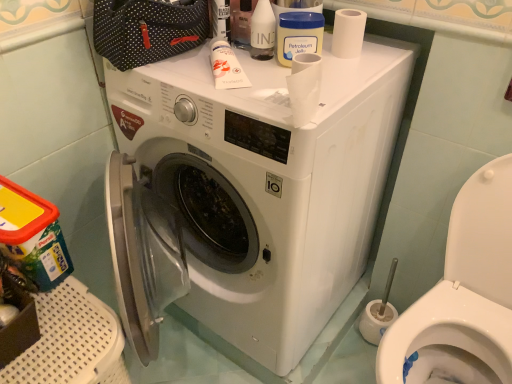
Where is `vacant space situated on the left part of translucent plastic bottle at upper center, the 2th toiletry in the bottom-to-top sequence`? vacant space situated on the left part of translucent plastic bottle at upper center, the 2th toiletry in the bottom-to-top sequence is located at coordinates (192, 63).